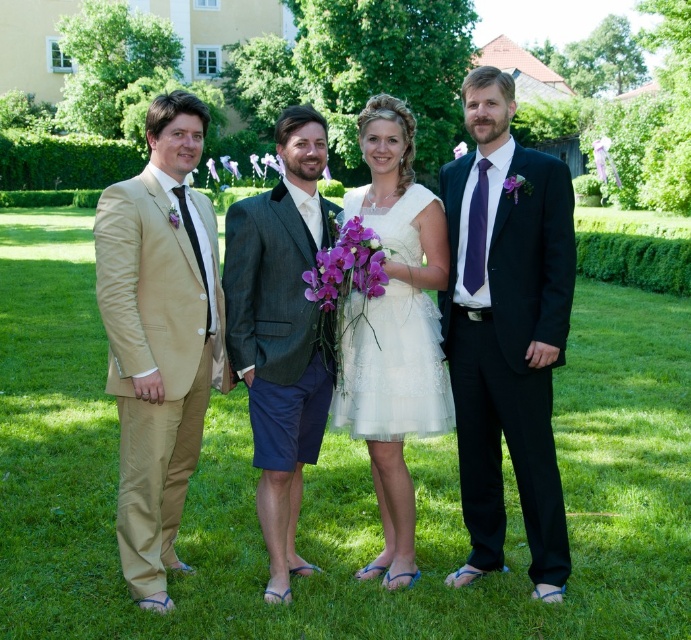
Question: Among these points, which one is farthest from the camera?

Choices:
 (A) (359, 257)
 (B) (530, 464)

Answer: (B)

Question: Is tan satin suit at left thinner than purple fabric flower at right?

Choices:
 (A) yes
 (B) no

Answer: (B)

Question: Among these points, which one is farthest from the camera?

Choices:
 (A) (531, 372)
 (B) (379, 320)

Answer: (B)

Question: Does purple silk flower at center have a larger size compared to purple fabric flower at center?

Choices:
 (A) yes
 (B) no

Answer: (A)

Question: Which object appears farthest from the camera in this image?

Choices:
 (A) purple fabric flower at center
 (B) matte black suit at right
 (C) purple fabric flower at right
 (D) green grass at center

Answer: (C)

Question: Is white lace dress at center bigger than purple fabric flower at center?

Choices:
 (A) yes
 (B) no

Answer: (A)